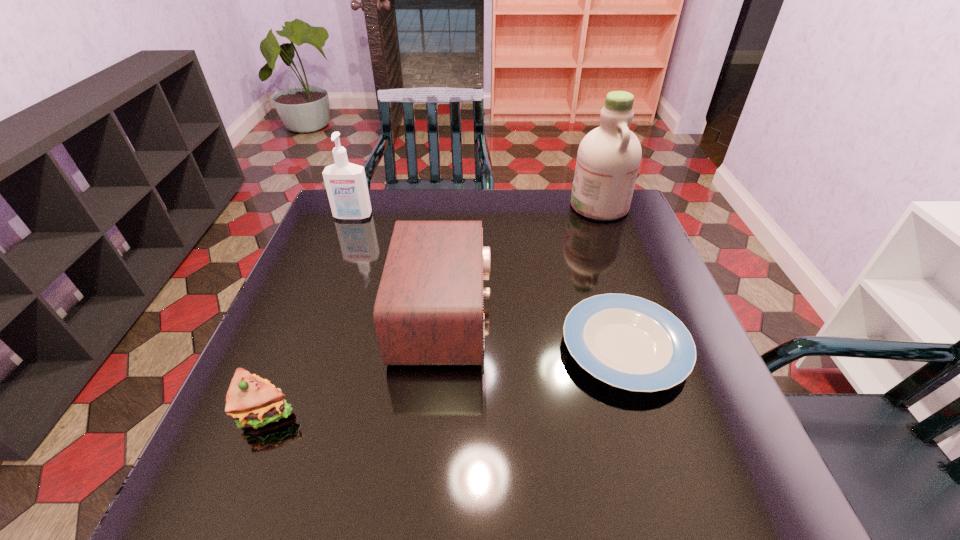
This screenshot has height=540, width=960. Identify the location of vacant area situated 0.060m on the front label of the taller cleansing agent. (552, 206).

Where is `vacant region located on the front label of the left cleansing agent`? This screenshot has height=540, width=960. vacant region located on the front label of the left cleansing agent is located at coordinates (319, 305).

Locate an element on the screen. The width and height of the screenshot is (960, 540). vacant space located 0.110m on the front panel of the third object from right to left is located at coordinates (536, 316).

Identify the location of free space located on the back of the fourth tallest object. The width and height of the screenshot is (960, 540). (317, 287).

Locate an element on the screen. This screenshot has width=960, height=540. vacant space positioned on the back of the shortest object is located at coordinates (590, 239).

Identify the location of cleansing agent present at the left edge. (346, 185).

Where is `sandwich present at the left edge`? sandwich present at the left edge is located at coordinates (251, 401).

This screenshot has width=960, height=540. I want to click on cleansing agent that is at the right edge, so click(608, 159).

What are the coordinates of `plate at the right edge` in the screenshot? It's located at (626, 341).

Identify the location of object that is positioned at the far left corner. (346, 185).